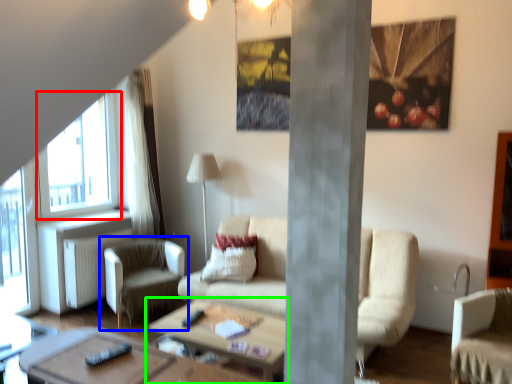
Question: Which object is positioned farthest from window (highlighted by a red box)? Select from chair (highlighted by a blue box) and coffee table (highlighted by a green box).

Choices:
 (A) chair
 (B) coffee table

Answer: (B)